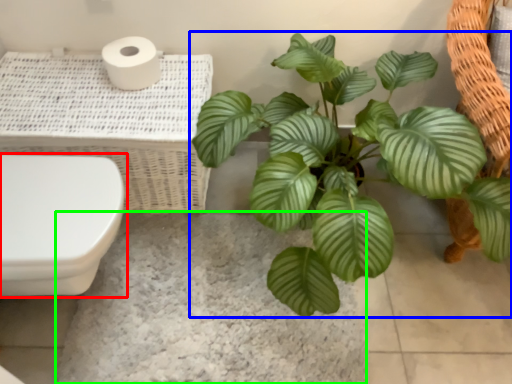
Question: Estimate the real-world distances between objects in this image. Which object is closer to toilet (highlighted by a red box), houseplant (highlighted by a blue box) or concrete (highlighted by a green box)?

Choices:
 (A) houseplant
 (B) concrete

Answer: (B)